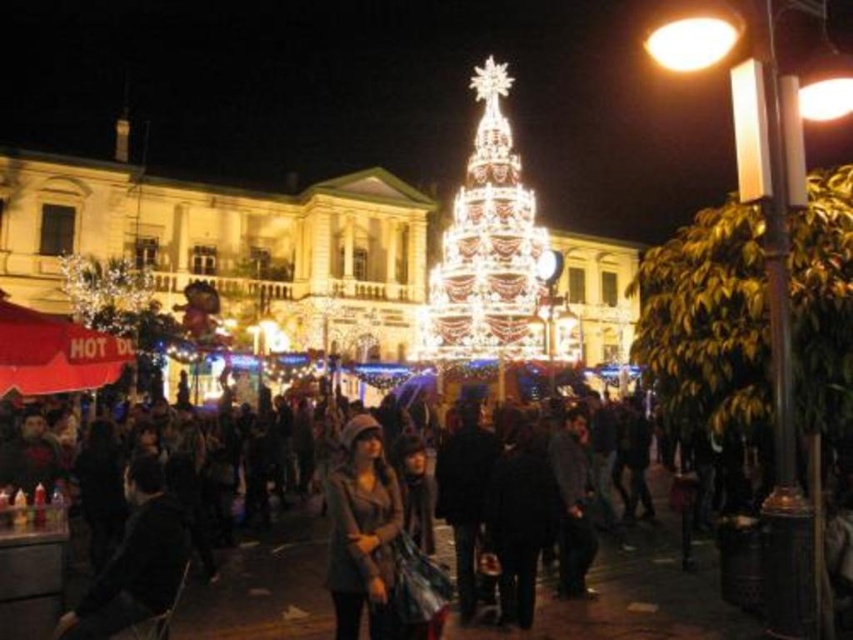
Is dark gray coat at center shorter than illuminated glass christmas tree at center?

Correct, dark gray coat at center is not as tall as illuminated glass christmas tree at center.

Which is above, dark gray coat at center or illuminated glass christmas tree at center?

illuminated glass christmas tree at center is higher up.

Who is more forward, (648, 616) or (485, 179)?

Point (648, 616) is more forward.

I want to click on dark gray coat at center, so click(x=616, y=593).

The width and height of the screenshot is (853, 640). What do you see at coordinates (616, 593) in the screenshot?
I see `dark gray coat at center` at bounding box center [616, 593].

Does dark gray coat at center appear under matte gray coat at center?

Indeed, dark gray coat at center is positioned under matte gray coat at center.

Is point (605, 621) farther from viewer compared to point (363, 467)?

That is False.

Locate an element on the screen. This screenshot has width=853, height=640. dark gray coat at center is located at coordinates (616, 593).

Can you confirm if illuminated glass christmas tree at center is bigger than matte gray coat at center?

Yes.

Describe the element at coordinates (491, 253) in the screenshot. Image resolution: width=853 pixels, height=640 pixels. I see `illuminated glass christmas tree at center` at that location.

Where is `illuminated glass christmas tree at center`? This screenshot has height=640, width=853. illuminated glass christmas tree at center is located at coordinates (491, 253).

Locate an element on the screen. Image resolution: width=853 pixels, height=640 pixels. illuminated glass christmas tree at center is located at coordinates (491, 253).